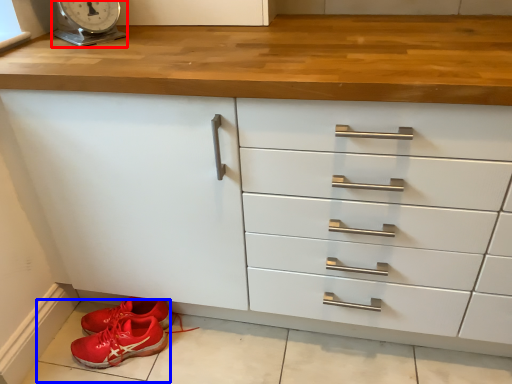
Question: Which object is further to the camera taking this photo, scale (highlighted by a red box) or tile (highlighted by a blue box)?

Choices:
 (A) scale
 (B) tile

Answer: (B)